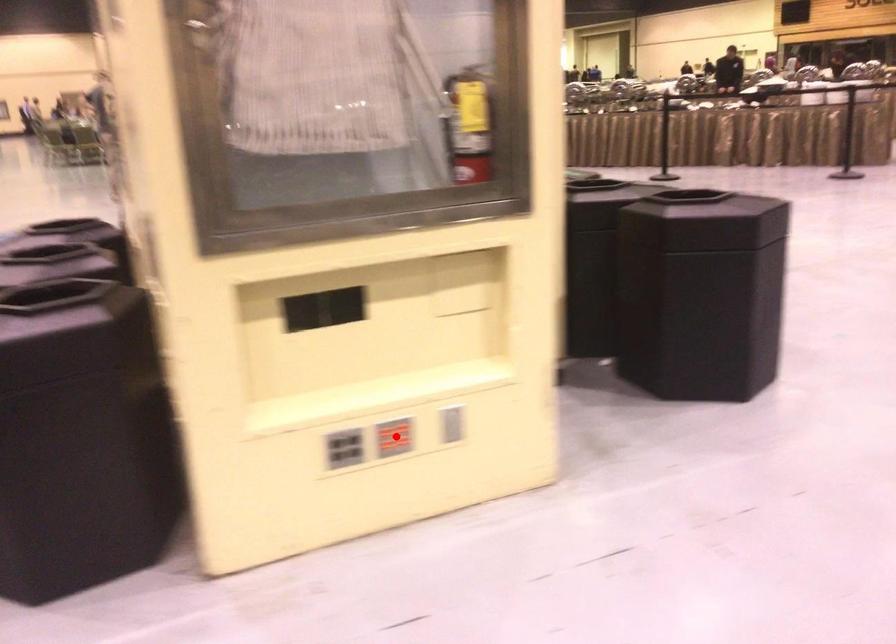
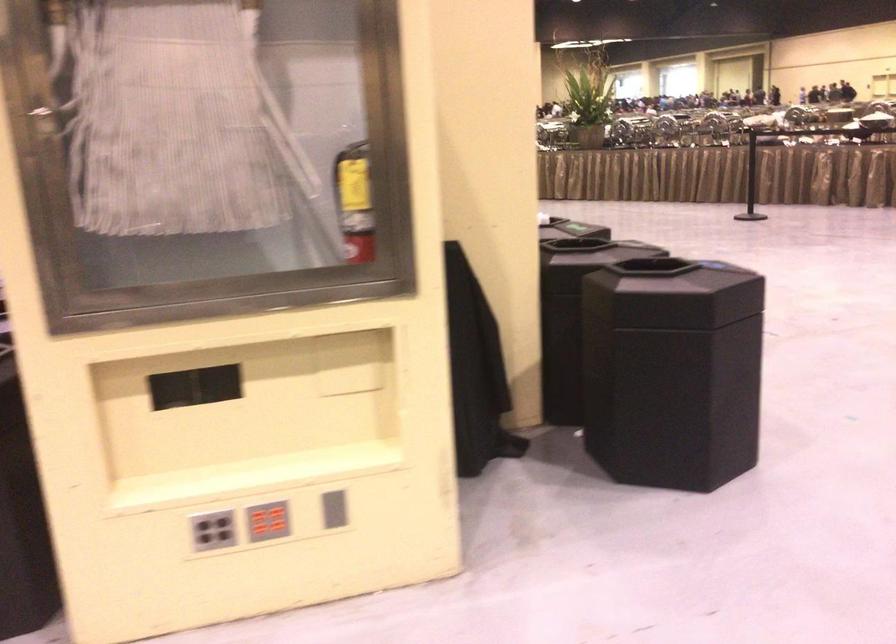
Find the pixel in the second image that matches the highlighted location in the first image.

(268, 521)